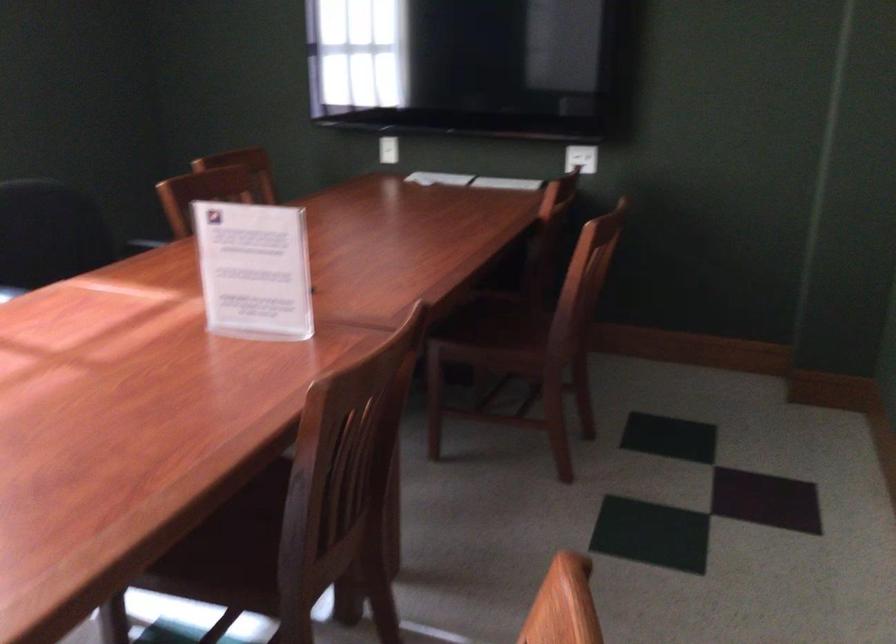
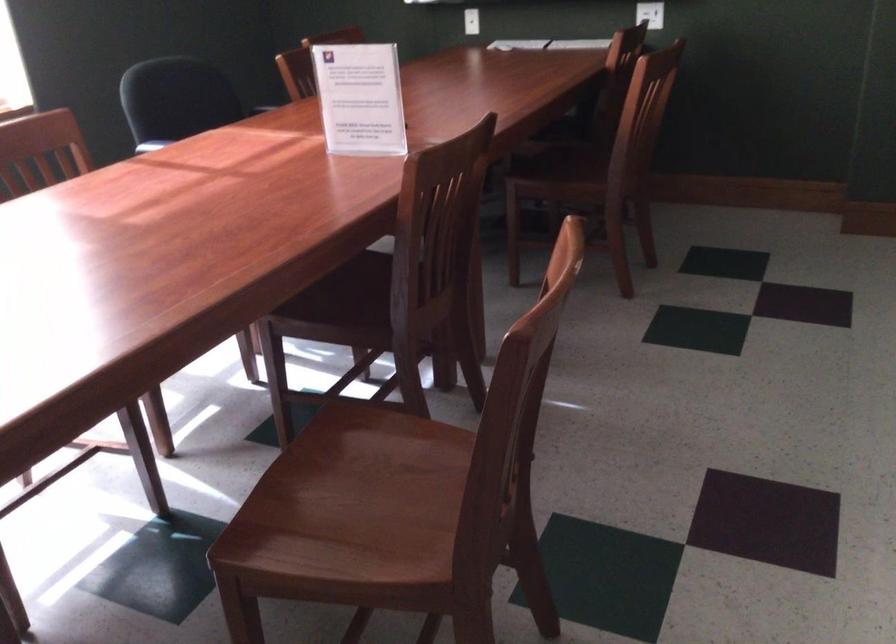
In the second image, find the point that corresponds to point (587, 161) in the first image.

(650, 14)